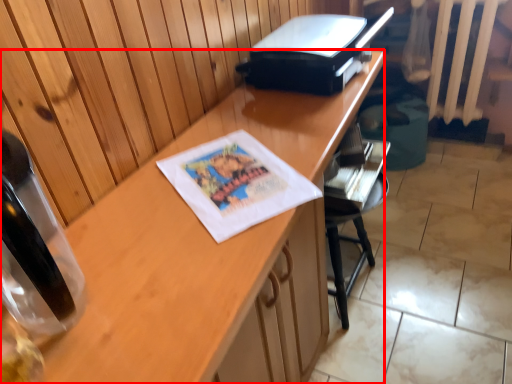
Question: From the image's perspective, what is the correct spatial relationship of desk (annotated by the red box) in relation to printer?

Choices:
 (A) above
 (B) below

Answer: (B)